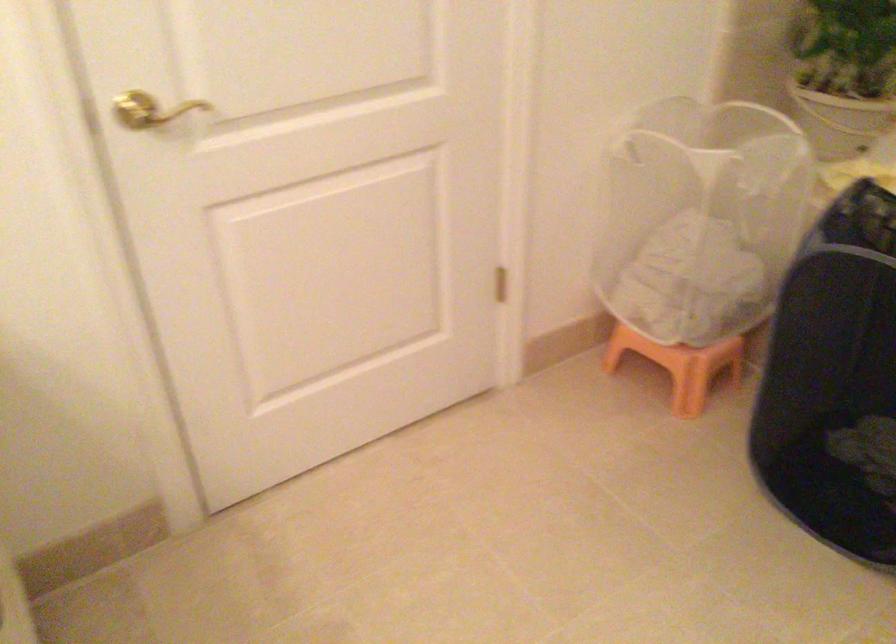
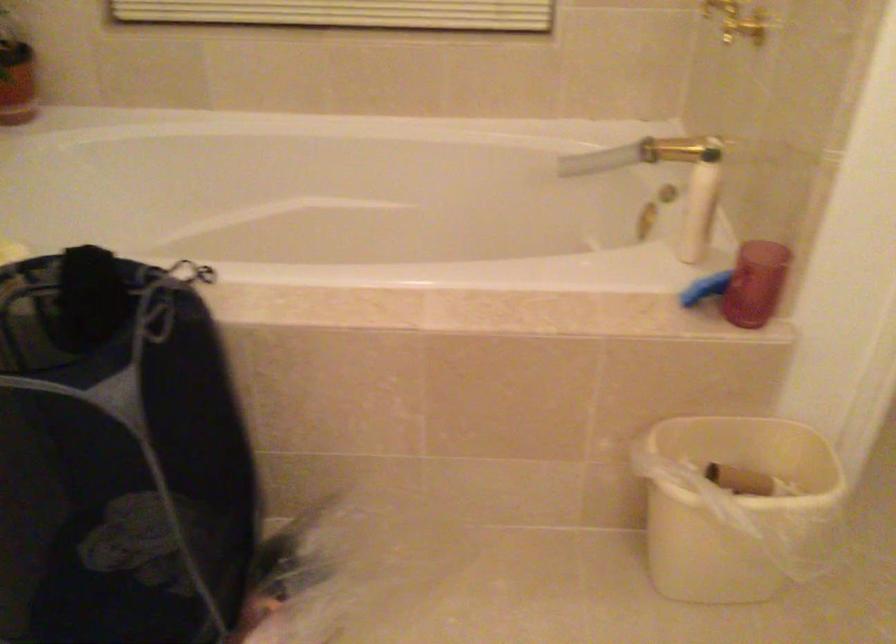
Question: Based on the continuous images, in which direction is the camera rotating? Reply with the corresponding letter.

Choices:
 (A) Left
 (B) Right
 (C) Up
 (D) Down

Answer: (B)